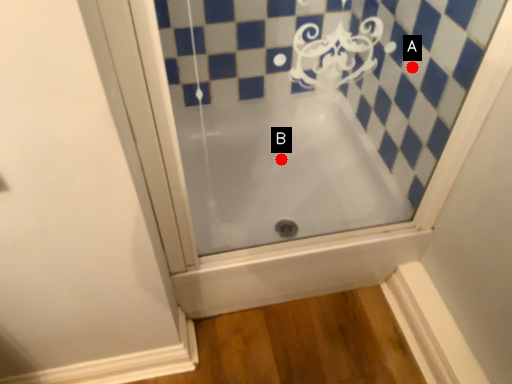
Question: Two points are circled on the image, labeled by A and B beside each circle. Among these points, which one is nearest to the camera?

Choices:
 (A) A is closer
 (B) B is closer

Answer: (A)